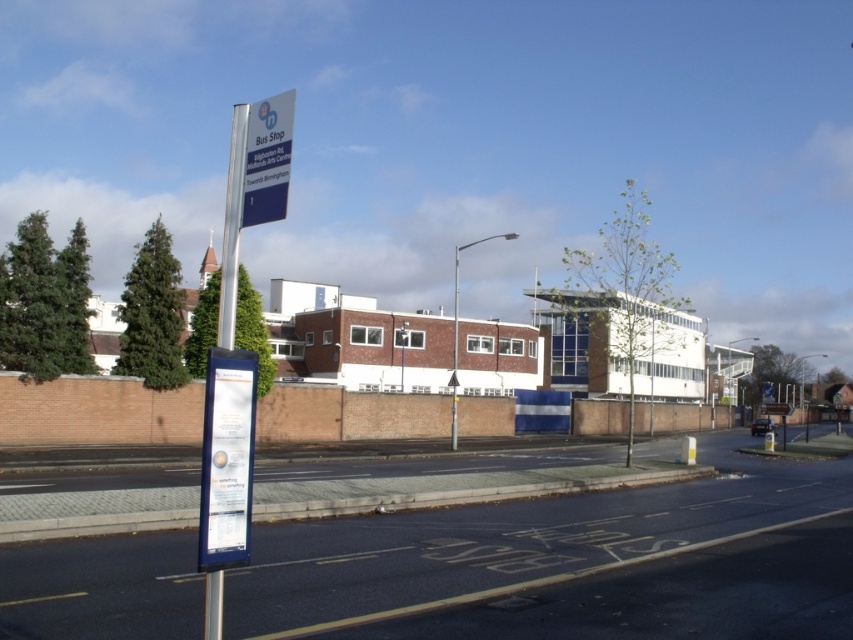
Question: Is the position of white plastic sign at center less distant than that of blue plastic sign at upper center?

Choices:
 (A) yes
 (B) no

Answer: (A)

Question: Which object appears closest to the camera in this image?

Choices:
 (A) metallic pole at center
 (B) blue plastic sign at upper center
 (C) white plastic sign at center

Answer: (C)

Question: Is blue plastic sign at upper center in front of metallic pole at center?

Choices:
 (A) no
 (B) yes

Answer: (B)

Question: Which of the following is the closest to the observer?

Choices:
 (A) blue plastic sign at upper center
 (B) metallic pole at center
 (C) white plastic sign at center

Answer: (C)

Question: Does white plastic sign at center come in front of blue plastic sign at upper center?

Choices:
 (A) no
 (B) yes

Answer: (B)

Question: Which point is closer to the camera taking this photo?

Choices:
 (A) (257, 124)
 (B) (451, 422)
 (C) (229, 476)

Answer: (C)